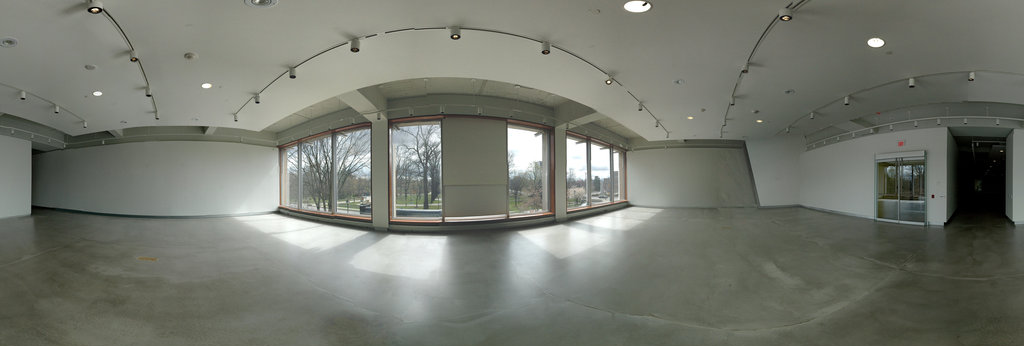
Locate an element on the screen. Image resolution: width=1024 pixels, height=346 pixels. right baseboard in hall is located at coordinates (1007, 217).